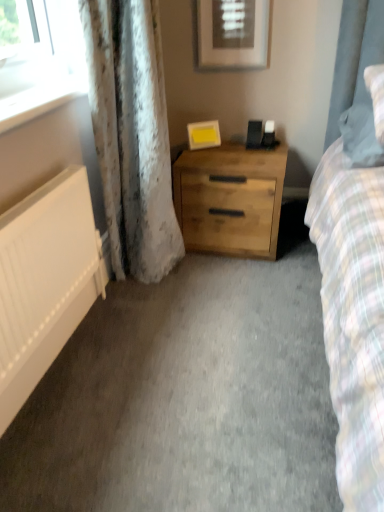
Locate an element on the screen. This screenshot has width=384, height=512. vacant area that lies to the right of yellow matte picture frame at center, which is counted as the 2th picture frame, starting from the top is located at coordinates [x=234, y=143].